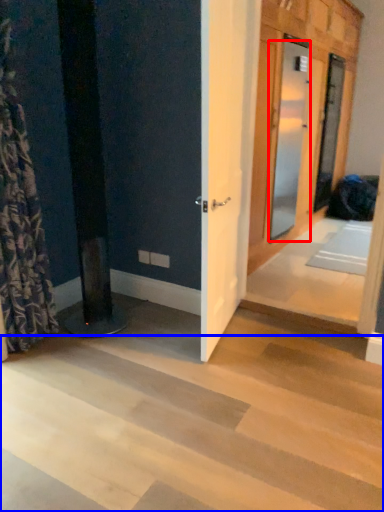
Question: Which of the following is the farthest to the observer, door (highlighted by a red box) or stairwell (highlighted by a blue box)?

Choices:
 (A) door
 (B) stairwell

Answer: (A)